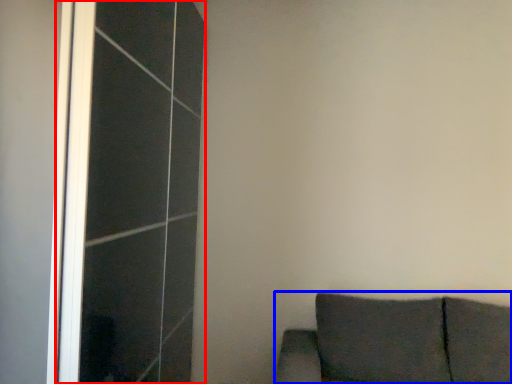
Question: Which of the following is the closest to the observer, screen door (highlighted by a red box) or furniture (highlighted by a blue box)?

Choices:
 (A) screen door
 (B) furniture

Answer: (B)